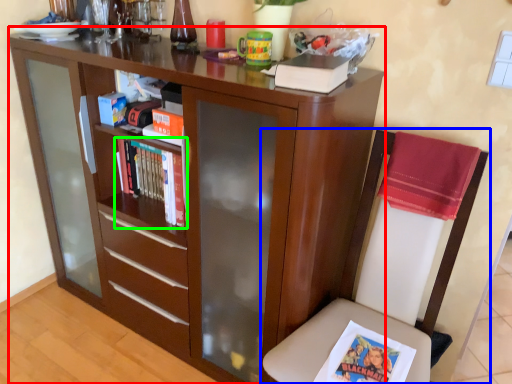
Question: Considering the real-world distances, which object is farthest from bookcase (highlighted by a red box)? chair (highlighted by a blue box) or book (highlighted by a green box)?

Choices:
 (A) chair
 (B) book

Answer: (A)